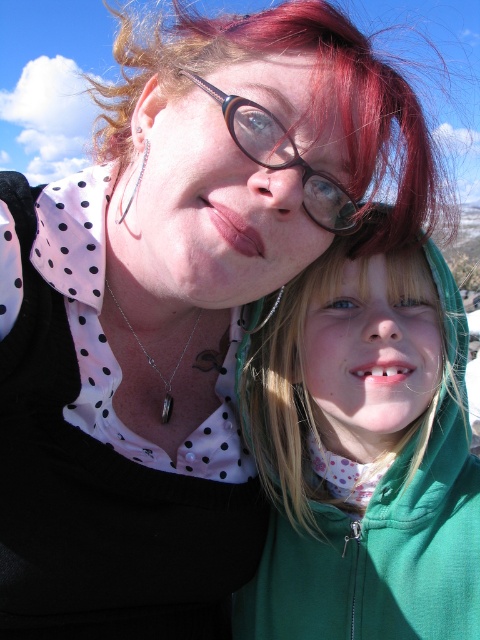
Who is taller, blonde hair at upper right or silver/black stone pendant at center?

Standing taller between the two is blonde hair at upper right.

This screenshot has height=640, width=480. Find the location of `blonde hair at upper right`. blonde hair at upper right is located at coordinates (312, 96).

Locate an element on the screen. blonde hair at upper right is located at coordinates (312, 96).

From the picture: Is blonde hair at upper right thinner than brown/black/glossy glasses at center?

In fact, blonde hair at upper right might be wider than brown/black/glossy glasses at center.

Where is `blonde hair at upper right`? Image resolution: width=480 pixels, height=640 pixels. blonde hair at upper right is located at coordinates (312, 96).

Does green fleece jacket at lower right have a greater height compared to silver/black stone pendant at center?

Indeed, green fleece jacket at lower right has a greater height compared to silver/black stone pendant at center.

Does point (328, 380) come behind point (187, 339)?

No, it is not.

Locate an element on the screen. green fleece jacket at lower right is located at coordinates (363, 449).